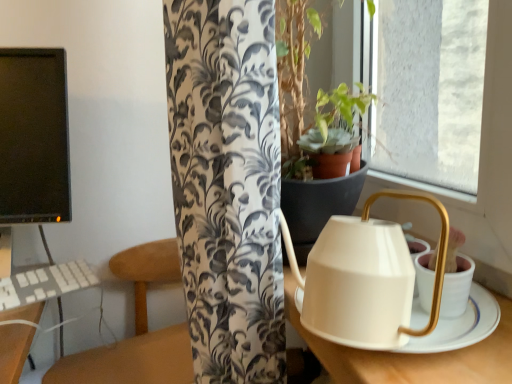
Question: Can you confirm if wooden table at center is wider than white plastic keyboard at lower left?

Choices:
 (A) yes
 (B) no

Answer: (A)

Question: Considering the relative sizes of wooden table at center and white plastic keyboard at lower left in the image provided, is wooden table at center taller than white plastic keyboard at lower left?

Choices:
 (A) yes
 (B) no

Answer: (A)

Question: From a real-world perspective, is wooden table at center positioned over white plastic keyboard at lower left based on gravity?

Choices:
 (A) no
 (B) yes

Answer: (A)

Question: Is wooden table at center not inside white plastic keyboard at lower left?

Choices:
 (A) yes
 (B) no

Answer: (A)

Question: Is wooden table at center directly adjacent to white plastic keyboard at lower left?

Choices:
 (A) no
 (B) yes

Answer: (A)

Question: Considering the positions of white plastic keyboard at lower left and white matte kettle at right in the image, is white plastic keyboard at lower left taller or shorter than white matte kettle at right?

Choices:
 (A) short
 (B) tall

Answer: (A)

Question: Is white plastic keyboard at lower left inside or outside of white matte kettle at right?

Choices:
 (A) outside
 (B) inside

Answer: (A)

Question: Does point (10, 281) appear closer or farther from the camera than point (504, 377)?

Choices:
 (A) closer
 (B) farther

Answer: (B)

Question: From a real-world perspective, relative to white matte kettle at right, is white plastic keyboard at lower left vertically above or below?

Choices:
 (A) above
 (B) below

Answer: (B)

Question: Is white plastic keyboard at lower left taller or shorter than black matte monitor at left?

Choices:
 (A) short
 (B) tall

Answer: (A)

Question: Is white plastic keyboard at lower left spatially inside black matte monitor at left, or outside of it?

Choices:
 (A) outside
 (B) inside

Answer: (B)

Question: Visually, is white plastic keyboard at lower left positioned to the left or to the right of black matte monitor at left?

Choices:
 (A) right
 (B) left

Answer: (B)

Question: From the image's perspective, is white plastic keyboard at lower left located above or below black matte monitor at left?

Choices:
 (A) above
 (B) below

Answer: (B)

Question: From the image's perspective, is wooden table at center above or below black matte monitor at left?

Choices:
 (A) below
 (B) above

Answer: (A)

Question: Based on their sizes in the image, would you say wooden table at center is bigger or smaller than black matte monitor at left?

Choices:
 (A) big
 (B) small

Answer: (A)